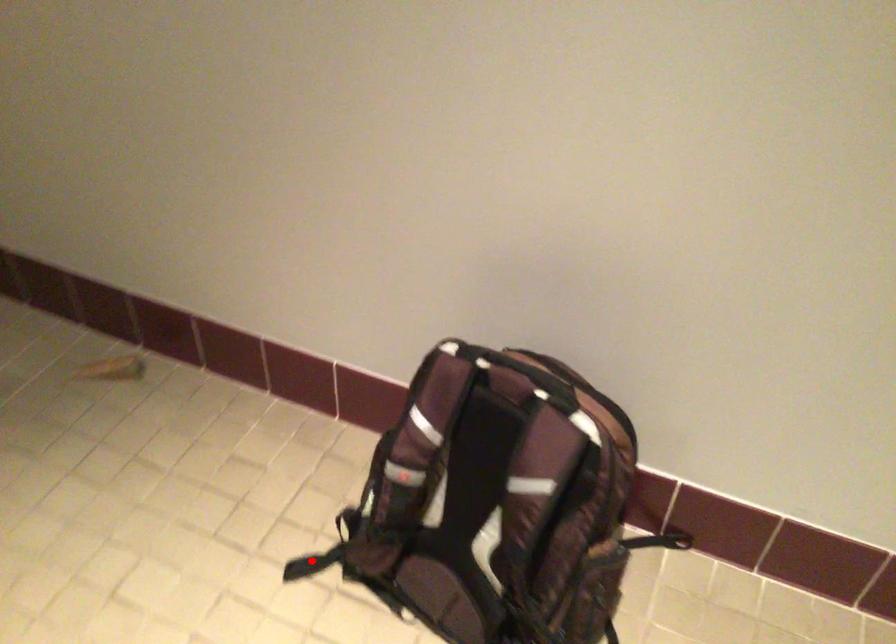
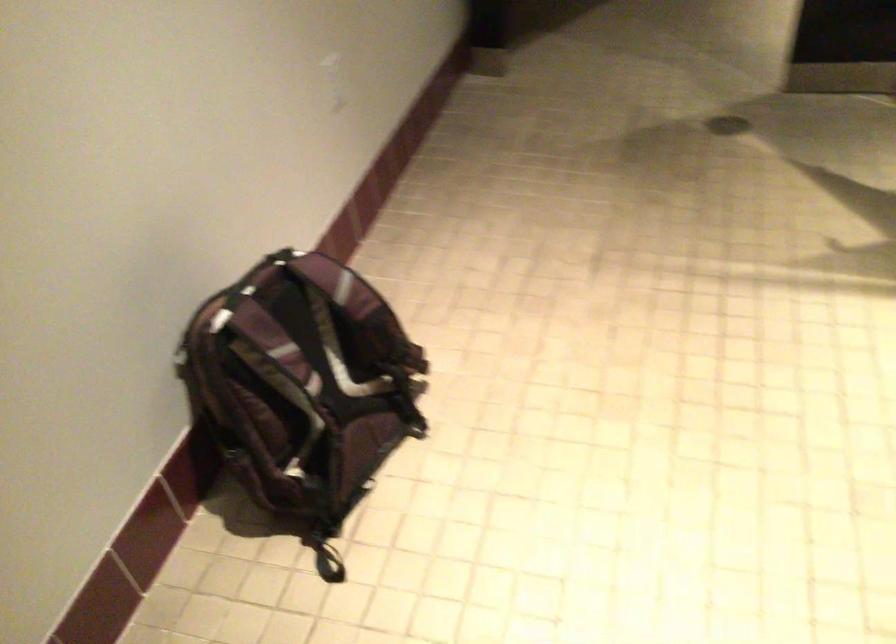
In the second image, find the point that corresponds to the highlighted location in the first image.

(328, 567)